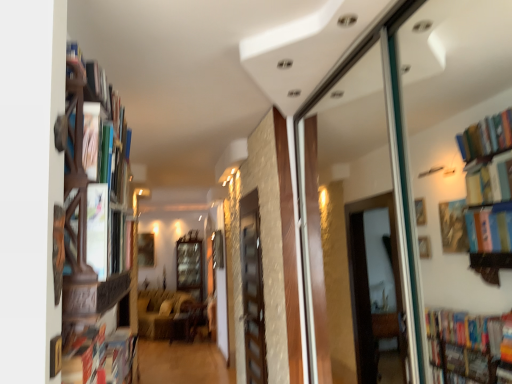
Question: Is wooden bookshelf at left beside velvet beige sofa at center?

Choices:
 (A) no
 (B) yes

Answer: (A)

Question: Is the depth of wooden bookshelf at left less than that of velvet beige sofa at center?

Choices:
 (A) no
 (B) yes

Answer: (B)

Question: From the image's perspective, would you say wooden bookshelf at left is shown under velvet beige sofa at center?

Choices:
 (A) yes
 (B) no

Answer: (B)

Question: Is wooden bookshelf at left facing towards velvet beige sofa at center?

Choices:
 (A) yes
 (B) no

Answer: (B)

Question: Can you confirm if wooden bookshelf at left is smaller than velvet beige sofa at center?

Choices:
 (A) no
 (B) yes

Answer: (B)

Question: Considering the relative sizes of wooden bookshelf at left and velvet beige sofa at center in the image provided, is wooden bookshelf at left thinner than velvet beige sofa at center?

Choices:
 (A) yes
 (B) no

Answer: (A)

Question: Does velvet beige sofa at center have a greater width compared to wooden cabinet at center?

Choices:
 (A) yes
 (B) no

Answer: (A)

Question: Is velvet beige sofa at center thinner than wooden cabinet at center?

Choices:
 (A) no
 (B) yes

Answer: (A)

Question: From a real-world perspective, is velvet beige sofa at center on wooden cabinet at center?

Choices:
 (A) yes
 (B) no

Answer: (B)

Question: Is velvet beige sofa at center to the right of wooden cabinet at center from the viewer's perspective?

Choices:
 (A) no
 (B) yes

Answer: (A)

Question: Is velvet beige sofa at center beside wooden cabinet at center?

Choices:
 (A) yes
 (B) no

Answer: (B)

Question: From a real-world perspective, is velvet beige sofa at center physically below wooden cabinet at center?

Choices:
 (A) no
 (B) yes

Answer: (B)

Question: From the image's perspective, is wooden cabinet at center beneath velvet beige sofa at center?

Choices:
 (A) no
 (B) yes

Answer: (A)